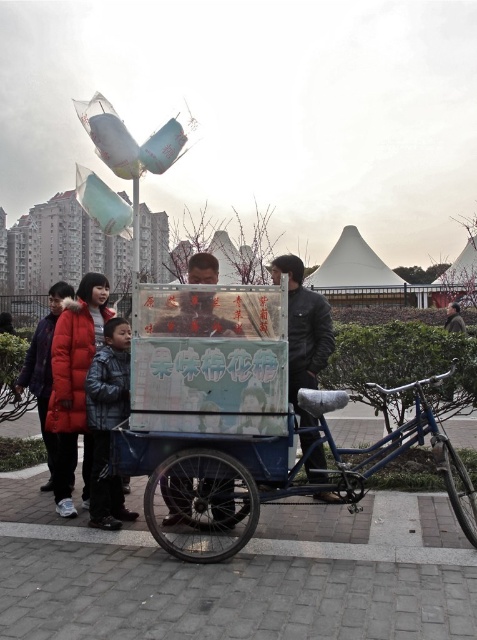
You are taking a photo of the food stall and want to focus on both the point at coordinates point (476, 529) and point (114, 362). Which point should you adjust your focus to first to ensure the closest object is in sharp detail?

Point (476, 529) is closer to the camera than point (114, 362), so you should focus on point (476, 529) first to ensure the closest object is in sharp detail.

You are standing at the entrance of the park and see the blue metallic bicycle at center. If you want to reach the bicycle, which direction should you move relative to your current position?

The blue metallic bicycle at center is located at point (207, 481), so you should move towards the center of the park to reach it.

You are a customer standing at the entrance of the food stall. You want to place your order and then move to the dark gray jacket at lower left. Given that you are 1.8 meters tall, can you comfortably reach the blue metallic bicycle at center to place your order without stretching too much?

The blue metallic bicycle at center and dark gray jacket at lower left are 1.14 meters apart from each other. Since you are 1.8 meters tall, you can comfortably reach the blue metallic bicycle at center to place your order without stretching too much as the distance between you and the bicycle is within a comfortable reach.